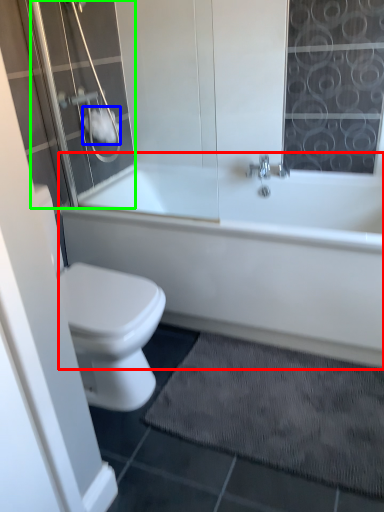
Question: Which object is the closest to the bathtub (highlighted by a red box)? Choose among these: toilet paper (highlighted by a blue box) or shower door (highlighted by a green box).

Choices:
 (A) toilet paper
 (B) shower door

Answer: (B)